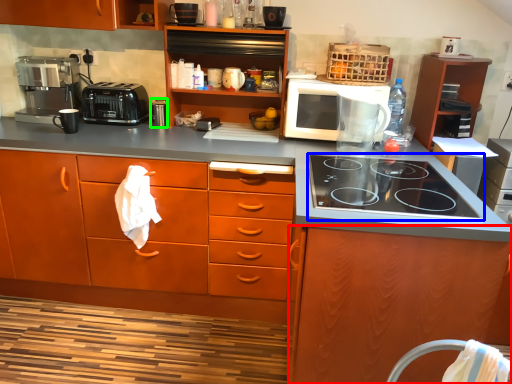
Question: Based on their relative distances, which object is nearer to cabinetry (highlighted by a red box)? Choose from gas stove (highlighted by a blue box) and appliance (highlighted by a green box).

Choices:
 (A) gas stove
 (B) appliance

Answer: (A)